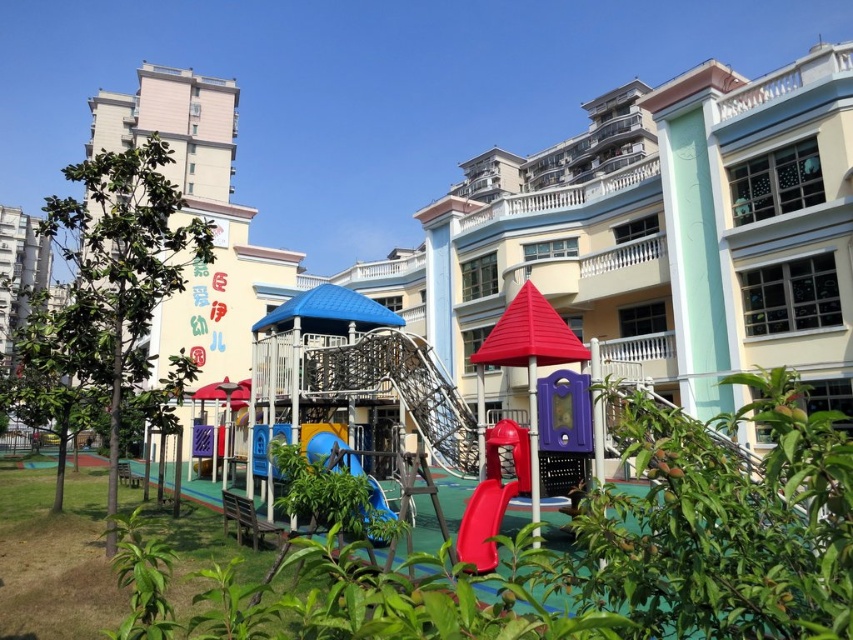
You are standing at the entrance of the playground and want to find the rubber smooth slide at center. According to the coordinates provided, in which direction should you walk to reach it?

The rubber smooth slide at center is located at coordinates point (483,524). Since the entrance is typically at the edge of the playground, you should walk towards the center area to reach it.

You are a parent trying to decide which slide to let your child play on. You notice the rubber smooth slide at center and the blue rubber slide at center. Which one is closer to you?

The rubber smooth slide at center is 1.48 meters away from blue rubber slide at center, so whichever slide you are standing closer to would determine the answer. However, based on the given information, the distance between them is fixed. Without knowing your exact position, it is impossible to determine which is closer to you personally.